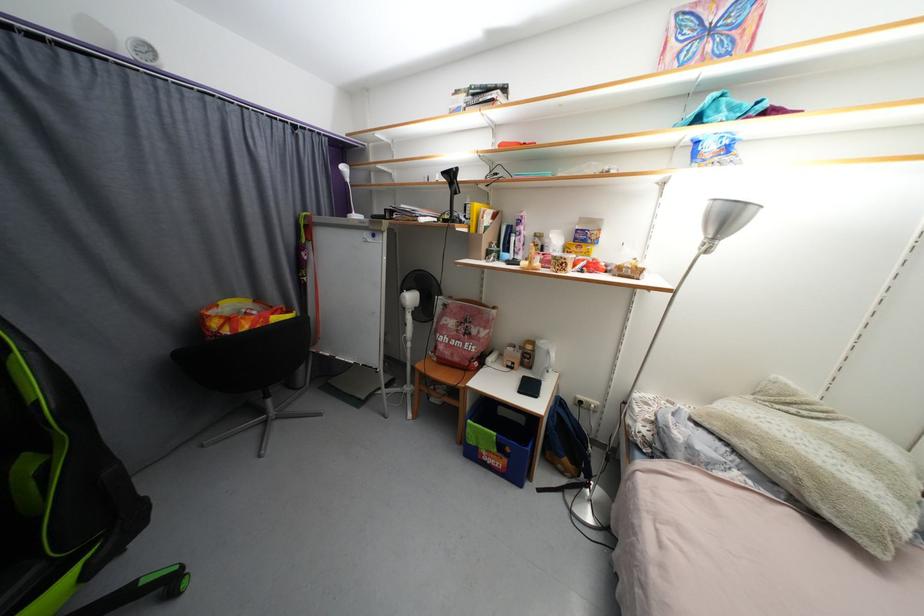
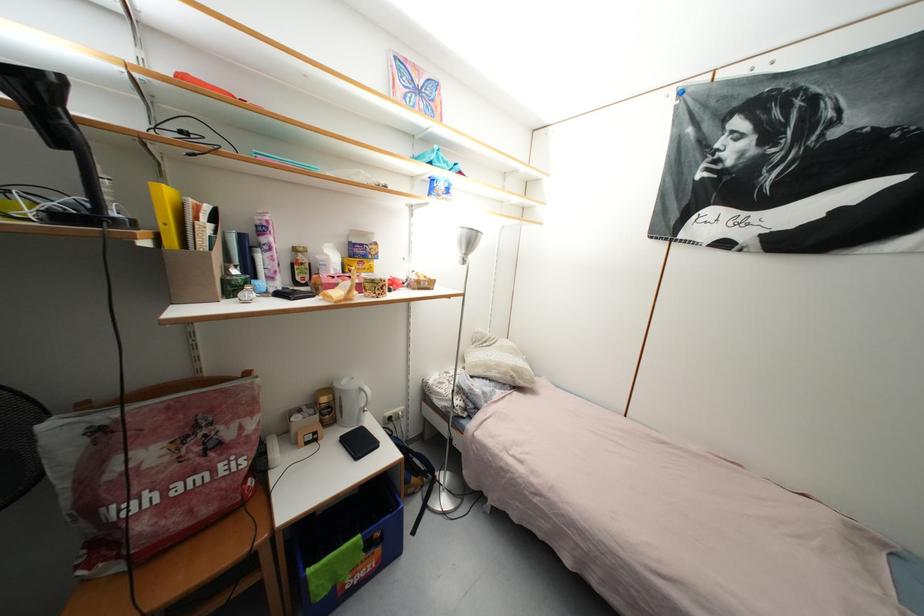
Question: The images are taken continuously from a first-person perspective. In which direction is your viewpoint rotating?

Choices:
 (A) Left
 (B) Right
 (C) Up
 (D) Down

Answer: (B)